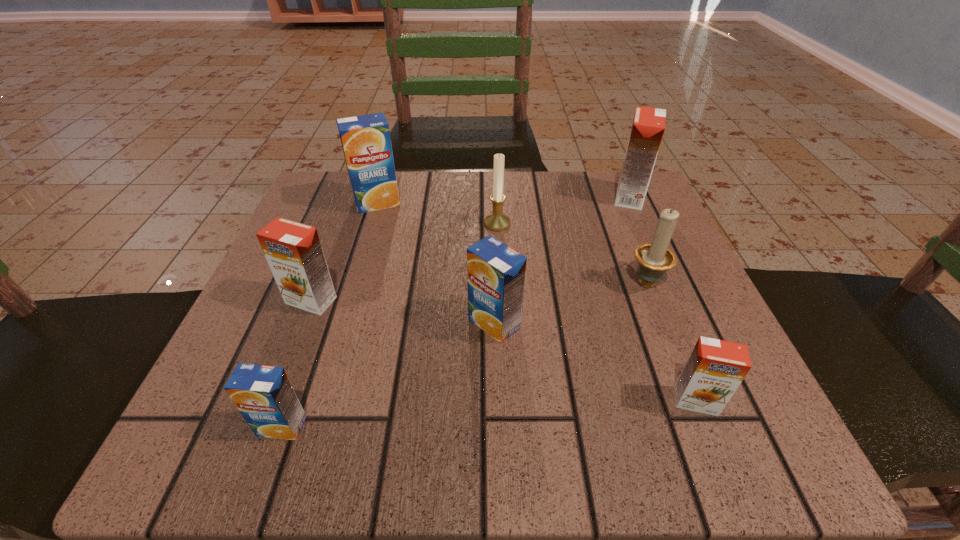
Where is `vacant area that lies between the sixth nearest object and the smallest orange orange juice`? The image size is (960, 540). vacant area that lies between the sixth nearest object and the smallest orange orange juice is located at coordinates (596, 312).

Locate an element on the screen. The width and height of the screenshot is (960, 540). unoccupied position between the nearest blue orange_juice and the nearer candle_holder is located at coordinates (464, 353).

Locate an element on the screen. free space between the smallest blue orange_juice and the nearer candle_holder is located at coordinates (464, 353).

Find the location of `object identified as the seventh closest to the nearest blue orange_juice`. object identified as the seventh closest to the nearest blue orange_juice is located at coordinates (648, 127).

Locate an element on the screen. object that stands as the fourth closest to the nearest orange orange juice is located at coordinates (648, 127).

Locate which orange_juice is the second closest to the biggest orange orange juice. Please provide its 2D coordinates. Your answer should be formatted as a tuple, i.e. [(x, y)], where the tuple contains the x and y coordinates of a point satisfying the conditions above.

[(715, 369)]

The height and width of the screenshot is (540, 960). I want to click on orange_juice that stands as the closest to the smallest orange orange juice, so click(x=496, y=273).

Point out which blue orange_juice is positioned as the third nearest to the smallest orange orange juice. Please provide its 2D coordinates. Your answer should be formatted as a tuple, i.e. [(x, y)], where the tuple contains the x and y coordinates of a point satisfying the conditions above.

[(366, 142)]

Identify the location of blue orange_juice identified as the second closest to the nearest blue orange_juice. Image resolution: width=960 pixels, height=540 pixels. (366, 142).

Select which orange orange juice appears as the closest to the smallest blue orange_juice. Please provide its 2D coordinates. Your answer should be formatted as a tuple, i.e. [(x, y)], where the tuple contains the x and y coordinates of a point satisfying the conditions above.

[(293, 251)]